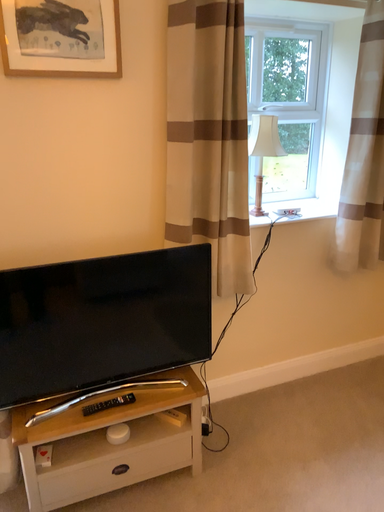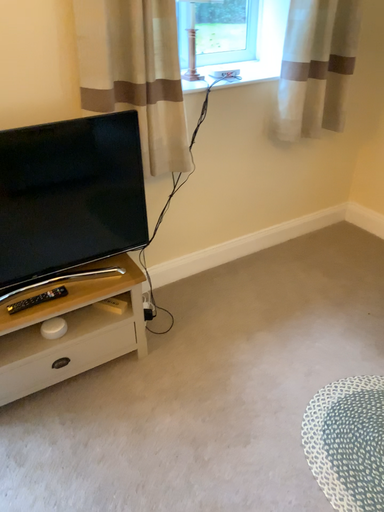
Question: Which way did the camera rotate in the video?

Choices:
 (A) rotated right
 (B) rotated left

Answer: (A)